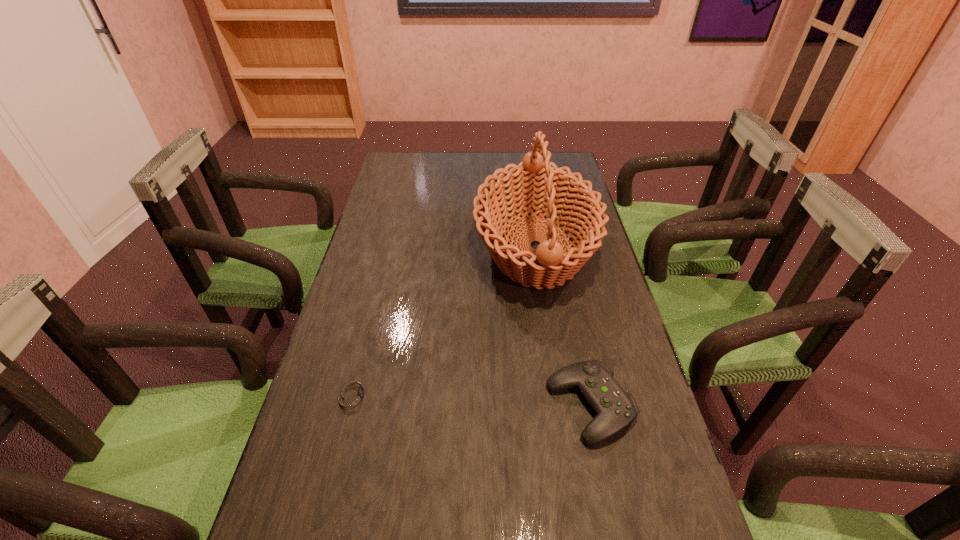
Locate an element on the screen. The height and width of the screenshot is (540, 960). basket is located at coordinates (534, 186).

Locate an element on the screen. The height and width of the screenshot is (540, 960). the farthest object is located at coordinates (534, 186).

Image resolution: width=960 pixels, height=540 pixels. I want to click on control, so click(615, 408).

Locate an element on the screen. This screenshot has height=540, width=960. watch is located at coordinates (352, 395).

Where is `the shortest object`? This screenshot has height=540, width=960. the shortest object is located at coordinates (352, 395).

At what (x,y) coordinates should I click in order to perform the action: click on free space located 0.230m on the left of the tallest object. Please return your answer as a coordinate pair (x, y). Image resolution: width=960 pixels, height=540 pixels. Looking at the image, I should click on (401, 247).

Locate an element on the screen. The width and height of the screenshot is (960, 540). free location located 0.190m on the back of the control is located at coordinates (570, 312).

This screenshot has height=540, width=960. What are the coordinates of `free space located 0.310m on the face of the watch` in the screenshot? It's located at (516, 394).

Identify the location of object that is at the left edge. (352, 395).

The image size is (960, 540). I want to click on basket that is at the right edge, so click(x=534, y=186).